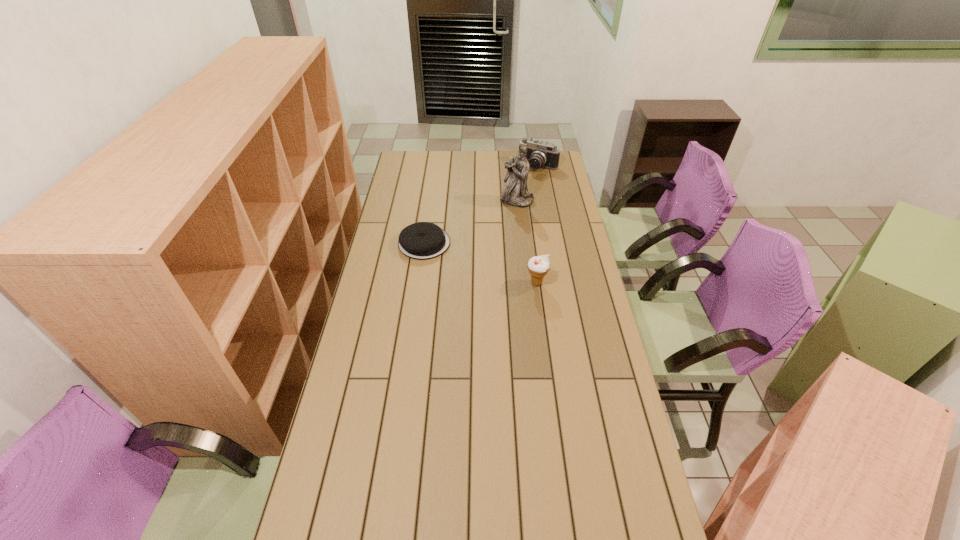
Where is `free space on the desktop that is between the pancake and the nearest object and is positioned on the front-facing side of the tallest object`? free space on the desktop that is between the pancake and the nearest object and is positioned on the front-facing side of the tallest object is located at coordinates 478,262.

This screenshot has width=960, height=540. I want to click on vacant space on the desktop that is between the shortest object and the nearest object and is positioned on the front-facing side of the camera, so click(x=474, y=261).